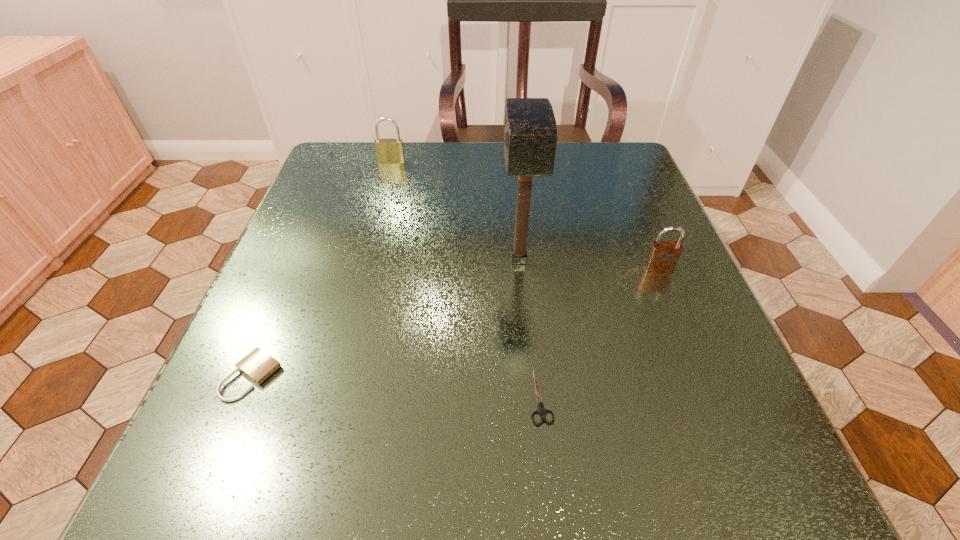
This screenshot has width=960, height=540. In order to click on mallet in this screenshot , I will do `click(530, 135)`.

Where is `the farthest padlock`? The height and width of the screenshot is (540, 960). the farthest padlock is located at coordinates (390, 151).

Find the location of `the second object from left to right`. the second object from left to right is located at coordinates (390, 151).

Locate an element on the screen. the third tallest object is located at coordinates (663, 256).

At what (x,y) coordinates should I click in order to perform the action: click on the rightmost padlock. Please return your answer as a coordinate pair (x, y). The image size is (960, 540). Looking at the image, I should click on (663, 256).

Identify the location of the leftmost padlock. The image size is (960, 540). (258, 365).

Find the location of a particular element. the fourth tallest object is located at coordinates (258, 365).

The image size is (960, 540). I want to click on shears, so click(x=542, y=411).

Where is `free space located 0.320m on the back of the tallest object`? The image size is (960, 540). free space located 0.320m on the back of the tallest object is located at coordinates (509, 155).

This screenshot has width=960, height=540. What are the coordinates of `vacant space located 0.250m on the front-facing side of the second padlock from left to right` in the screenshot? It's located at (373, 230).